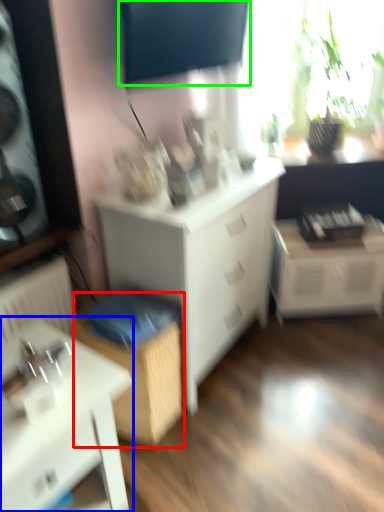
Question: Which is nearer to the cabinetry (highlighted by a red box)? table (highlighted by a blue box) or window screen (highlighted by a green box).

Choices:
 (A) table
 (B) window screen

Answer: (A)